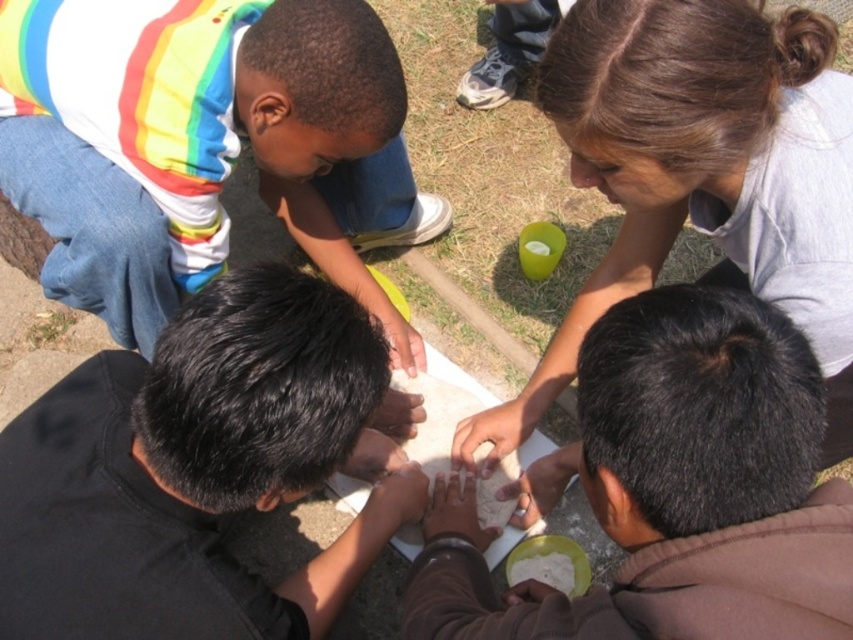
Does dark brown hair at upper center appear on the right side of rainbow striped shirt at upper left?

Correct, you'll find dark brown hair at upper center to the right of rainbow striped shirt at upper left.

Between dark brown hair at upper center and rainbow striped shirt at upper left, which one is positioned higher?

Positioned higher is rainbow striped shirt at upper left.

Locate an element on the screen. dark brown hair at upper center is located at coordinates (701, 173).

Does black matte shirt at center lie behind rainbow striped shirt at upper left?

No, it is in front of rainbow striped shirt at upper left.

The width and height of the screenshot is (853, 640). What do you see at coordinates (194, 470) in the screenshot? I see `black matte shirt at center` at bounding box center [194, 470].

Find the location of `black matte shirt at center`. black matte shirt at center is located at coordinates (194, 470).

Does black matte shirt at center have a greater width compared to dark brown hair at upper center?

Incorrect, black matte shirt at center's width does not surpass dark brown hair at upper center's.

Which is above, black matte shirt at center or dark brown hair at upper center?

dark brown hair at upper center

Find the location of a particular element. The image size is (853, 640). black matte shirt at center is located at coordinates (194, 470).

At what (x,y) coordinates should I click in order to perform the action: click on black matte shirt at center. Please return your answer as a coordinate pair (x, y). The image size is (853, 640). Looking at the image, I should click on (194, 470).